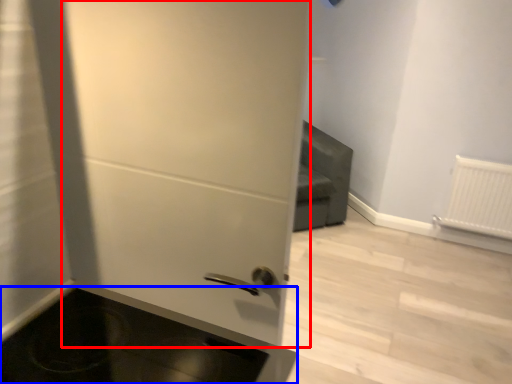
Question: Which point is further to the camera, door (highlighted by a red box) or appliance (highlighted by a blue box)?

Choices:
 (A) door
 (B) appliance

Answer: (A)